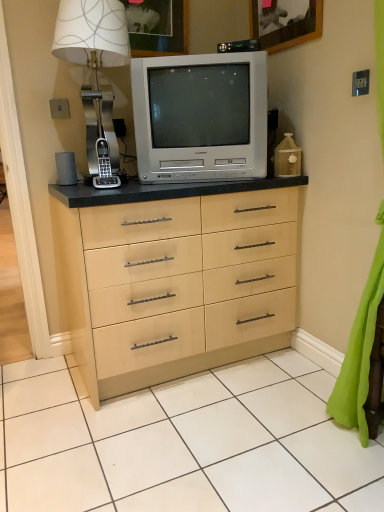
Identify the location of wooden picture frame at upper center, the 1th picture frame in the right-to-left sequence. (285, 22).

Where is `metallic silver table lamp at upper left`? metallic silver table lamp at upper left is located at coordinates (95, 65).

Measure the distance between green fabric curtain at lower right and camera.

green fabric curtain at lower right and camera are 1.29 meters apart.

Describe the element at coordinates (104, 167) in the screenshot. I see `black plastic phone at left` at that location.

Locate an element on the screen. The image size is (384, 512). wooden picture frame at upper center, the 2th picture frame when ordered from left to right is located at coordinates (285, 22).

From the image's perspective, between wooden picture frame at upper center, the 2th picture frame when ordered from left to right, and silver metallic television at center, who is located below?

silver metallic television at center, from the image's perspective.

Looking at the image, does wooden picture frame at upper center, the 1th picture frame in the right-to-left sequence, seem bigger or smaller compared to silver metallic television at center?

In the image, wooden picture frame at upper center, the 1th picture frame in the right-to-left sequence, appears to be smaller than silver metallic television at center.

Which object is wider, wooden picture frame at upper center, the 2th picture frame when ordered from left to right, or silver metallic television at center?

silver metallic television at center.

Is wooden picture frame at upper center, the 1th picture frame in the right-to-left sequence, directly adjacent to silver metallic television at center?

There is a gap between wooden picture frame at upper center, the 1th picture frame in the right-to-left sequence, and silver metallic television at center.

The height and width of the screenshot is (512, 384). Find the location of `curtain below the wooden picture frame at upper center, the 1th picture frame in the right-to-left sequence (from a real-world perspective)`. curtain below the wooden picture frame at upper center, the 1th picture frame in the right-to-left sequence (from a real-world perspective) is located at coordinates (360, 350).

Which object is wider, green fabric curtain at lower right or wooden picture frame at upper center, the 2th picture frame when ordered from left to right?

Wider between the two is green fabric curtain at lower right.

Which object is further away from the camera, metallic silver table lamp at upper left or matte white picture frame at upper center, placed as the 1th picture frame when sorted from left to right?

matte white picture frame at upper center, placed as the 1th picture frame when sorted from left to right, is further away from the camera.

I want to click on the 1st picture frame to the right when counting from the metallic silver table lamp at upper left, so click(159, 28).

Can you see metallic silver table lamp at upper left touching matte white picture frame at upper center, which is the 2th picture frame from right to left?

No, metallic silver table lamp at upper left is not next to matte white picture frame at upper center, which is the 2th picture frame from right to left.

From the image's perspective, which is below, green fabric curtain at lower right or metallic silver table lamp at upper left?

From the image's view, green fabric curtain at lower right is below.

You are a GUI agent. You are given a task and a screenshot of the screen. Output one action in this format:
    pyautogui.click(x=<x>, y=<y>)
    Task: Click on the curtain below the metallic silver table lamp at upper left (from a real-world perspective)
    
    Given the screenshot: What is the action you would take?
    pyautogui.click(x=360, y=350)

Looking at their sizes, would you say green fabric curtain at lower right is wider or thinner than metallic silver table lamp at upper left?

In the image, green fabric curtain at lower right appears to be more narrow than metallic silver table lamp at upper left.

How different are the orientations of green fabric curtain at lower right and metallic silver table lamp at upper left in degrees?

green fabric curtain at lower right and metallic silver table lamp at upper left are facing 97.1 degrees away from each other.

Which is closer, [151,47] or [116,179]?

Point [151,47] is positioned farther from the camera compared to point [116,179].

Are matte white picture frame at upper center, which is the 2th picture frame from right to left, and metallic silver table lamp at upper left beside each other?

No, matte white picture frame at upper center, which is the 2th picture frame from right to left, is not with metallic silver table lamp at upper left.

This screenshot has height=512, width=384. In order to click on table lamp below the matte white picture frame at upper center, which is the 2th picture frame from right to left (from a real-world perspective) in this screenshot , I will do `click(95, 65)`.

Looking at the image, does matte white picture frame at upper center, placed as the 1th picture frame when sorted from left to right, seem bigger or smaller compared to metallic silver table lamp at upper left?

Considering their sizes, matte white picture frame at upper center, placed as the 1th picture frame when sorted from left to right, takes up less space than metallic silver table lamp at upper left.

Is silver metallic television at center positioned with its back to black plastic phone at left?

That's not correct — silver metallic television at center is not looking away from black plastic phone at left.

From the image's perspective, does silver metallic television at center appear higher than black plastic phone at left?

Yes.

Is silver metallic television at center in front of black plastic phone at left?

Yes, it is.

Looking at the image, does silver metallic television at center seem bigger or smaller compared to black plastic phone at left?

Clearly, silver metallic television at center is larger in size than black plastic phone at left.

Considering the relative sizes of black plastic phone at left and green fabric curtain at lower right in the image provided, is black plastic phone at left thinner than green fabric curtain at lower right?

Yes.

Based on their positions, is black plastic phone at left located to the left or right of green fabric curtain at lower right?

Based on their positions, black plastic phone at left is located to the left of green fabric curtain at lower right.

In the image, is black plastic phone at left positioned in front of or behind green fabric curtain at lower right?

Visually, black plastic phone at left is located behind green fabric curtain at lower right.

Is black plastic phone at left not close to green fabric curtain at lower right?

Yes.

Where is `picture frame in front of the silver metallic television at center`? The image size is (384, 512). picture frame in front of the silver metallic television at center is located at coordinates (285, 22).

Locate an element on the screen. The height and width of the screenshot is (512, 384). curtain below the wooden picture frame at upper center, the 1th picture frame in the right-to-left sequence (from a real-world perspective) is located at coordinates (360, 350).

Based on their spatial positions, is wooden picture frame at upper center, the 2th picture frame when ordered from left to right, or black plastic phone at left closer to silver metallic television at center?

Based on the image, black plastic phone at left appears to be nearer to silver metallic television at center.

Based on their spatial positions, is wooden picture frame at upper center, the 2th picture frame when ordered from left to right, or silver metallic television at center further from black plastic phone at left?

wooden picture frame at upper center, the 2th picture frame when ordered from left to right, is further to black plastic phone at left.

Considering their positions, is wooden picture frame at upper center, the 2th picture frame when ordered from left to right, positioned further to silver metallic television at center than green fabric curtain at lower right?

Based on the image, green fabric curtain at lower right appears to be further to silver metallic television at center.

From the picture: Based on their spatial positions, is matte white picture frame at upper center, placed as the 1th picture frame when sorted from left to right, or metallic silver table lamp at upper left closer to silver metallic television at center?

metallic silver table lamp at upper left is positioned closer to the anchor silver metallic television at center.

Estimate the real-world distances between objects in this image. Which object is further from wooden picture frame at upper center, the 1th picture frame in the right-to-left sequence, black plastic phone at left or green fabric curtain at lower right?

Result: green fabric curtain at lower right is further to wooden picture frame at upper center, the 1th picture frame in the right-to-left sequence.

Looking at the image, which one is located further to wooden picture frame at upper center, the 1th picture frame in the right-to-left sequence, silver metallic television at center or black plastic phone at left?

black plastic phone at left is positioned further to the anchor wooden picture frame at upper center, the 1th picture frame in the right-to-left sequence.

From the image, which object appears to be nearer to metallic silver table lamp at upper left, silver metallic television at center or green fabric curtain at lower right?

silver metallic television at center.

Based on their spatial positions, is matte white picture frame at upper center, placed as the 1th picture frame when sorted from left to right, or metallic silver table lamp at upper left closer to green fabric curtain at lower right?

Among the two, metallic silver table lamp at upper left is located nearer to green fabric curtain at lower right.

Locate an element on the screen. This screenshot has height=512, width=384. television between black plastic phone at left and green fabric curtain at lower right is located at coordinates (200, 117).

Locate an element on the screen. gadget located between metallic silver table lamp at upper left and green fabric curtain at lower right in the left-right direction is located at coordinates (104, 167).

The height and width of the screenshot is (512, 384). In order to click on television between metallic silver table lamp at upper left and green fabric curtain at lower right in the horizontal direction in this screenshot , I will do pos(200,117).

The height and width of the screenshot is (512, 384). I want to click on gadget between metallic silver table lamp at upper left and wooden picture frame at upper center, the 2th picture frame when ordered from left to right, so click(104, 167).